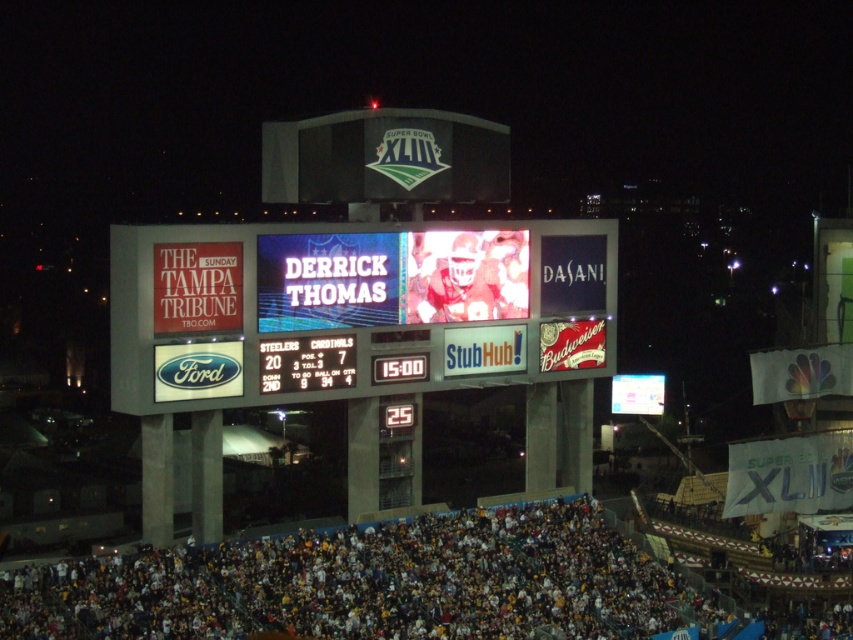
Question: Which object appears farthest from the camera in this image?

Choices:
 (A) led digital display at center
 (B) multicolored fabric crowd at lower center

Answer: (A)

Question: Which point is closer to the camera taking this photo?

Choices:
 (A) (90, 636)
 (B) (254, 260)

Answer: (A)

Question: Does led digital display at center appear under multicolored fabric crowd at lower center?

Choices:
 (A) yes
 (B) no

Answer: (B)

Question: Is led digital display at center in front of multicolored fabric crowd at lower center?

Choices:
 (A) no
 (B) yes

Answer: (A)

Question: Among these points, which one is farthest from the camera?

Choices:
 (A) (347, 620)
 (B) (184, 289)

Answer: (B)

Question: Does led digital display at center have a lesser width compared to multicolored fabric crowd at lower center?

Choices:
 (A) yes
 (B) no

Answer: (A)